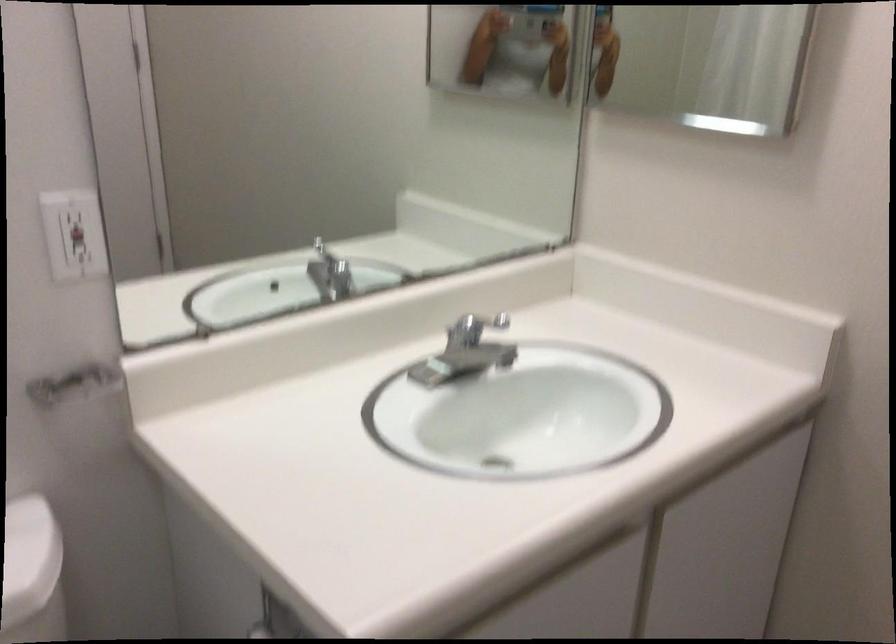
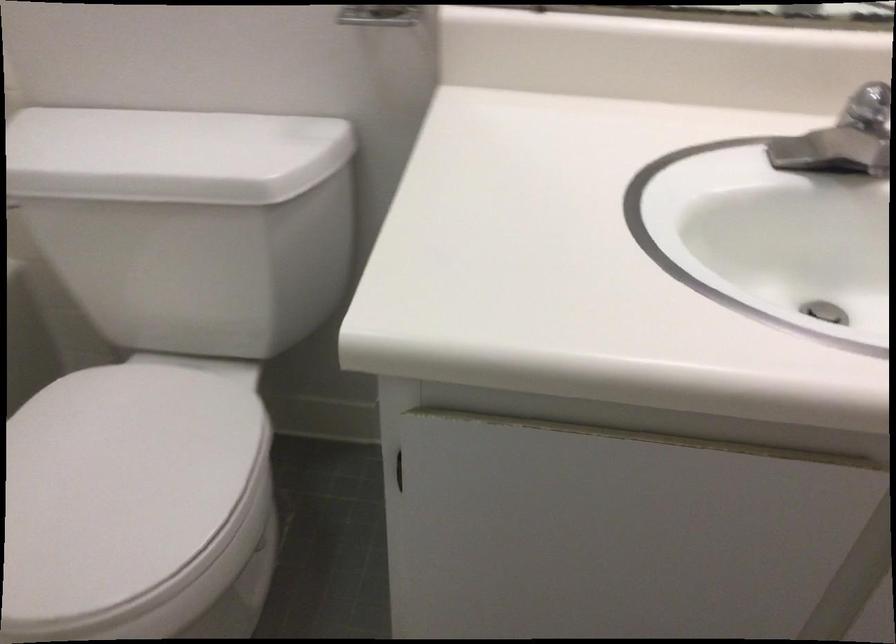
First-person continuous shooting, in which direction is the camera rotating?

The camera rotated toward left-down.